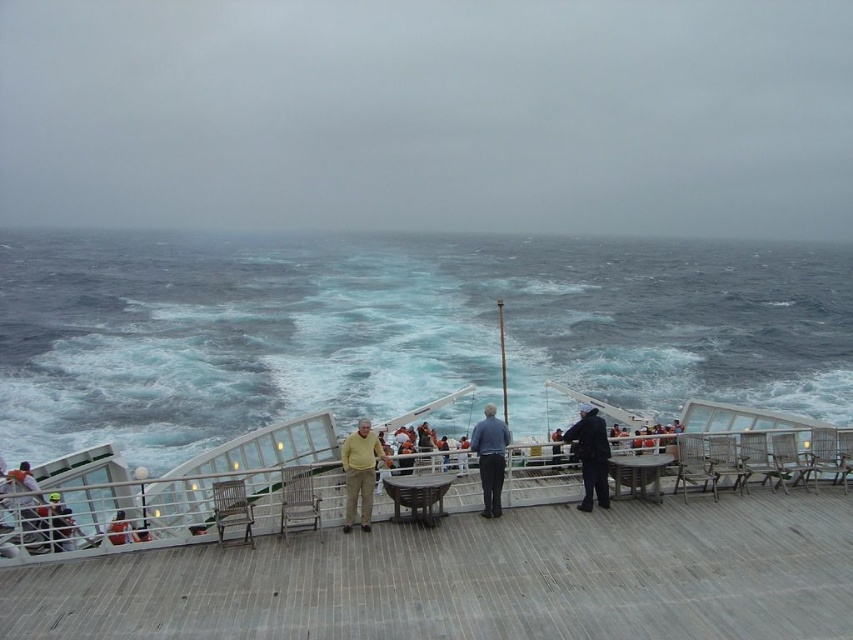
Question: Estimate the real-world distances between objects in this image. Which object is farther from the orange fabric jacket at lower left?

Choices:
 (A) wooden at center
 (B) dark blue uniform at center

Answer: (B)

Question: Considering the relative positions of yellow knit sweater at center and dark blue uniform at center in the image provided, where is yellow knit sweater at center located with respect to dark blue uniform at center?

Choices:
 (A) above
 (B) below

Answer: (B)

Question: Which point is closer to the camera?

Choices:
 (A) (364, 465)
 (B) (614, 596)
 (C) (288, 337)
 (D) (566, 440)

Answer: (B)

Question: Which object is closer to the camera taking this photo?

Choices:
 (A) orange fabric jacket at lower left
 (B) dark blue uniform at center

Answer: (A)

Question: Is blue denim jacket at center in front of dark blue jacket at center?

Choices:
 (A) yes
 (B) no

Answer: (A)

Question: Is the position of blue water at center less distant than that of dark blue uniform at center?

Choices:
 (A) yes
 (B) no

Answer: (B)